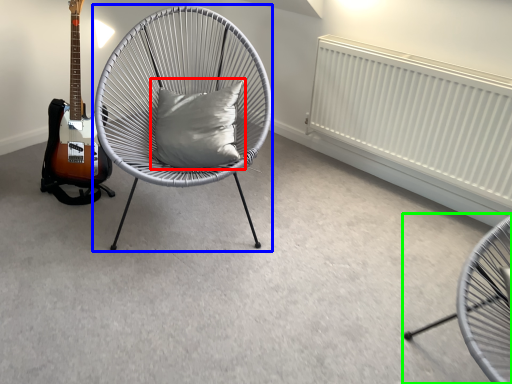
Question: Which is nearer to the pillow (highlighted by a red box)? chair (highlighted by a blue box) or chair (highlighted by a green box).

Choices:
 (A) chair
 (B) chair

Answer: (A)